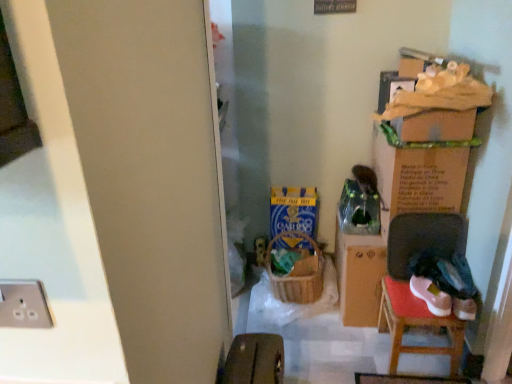
Where is `free space underneath wooden chair at lower right (from a real-world perspective)`? free space underneath wooden chair at lower right (from a real-world perspective) is located at coordinates (419, 352).